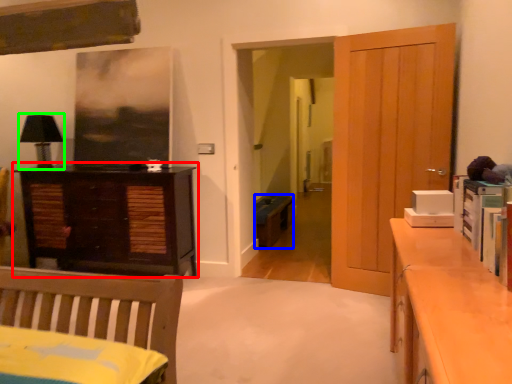
Question: Which object is the closest to the chest of drawers (highlighted by a red box)? Choose among these: cabinetry (highlighted by a blue box) or lamp (highlighted by a green box).

Choices:
 (A) cabinetry
 (B) lamp

Answer: (B)